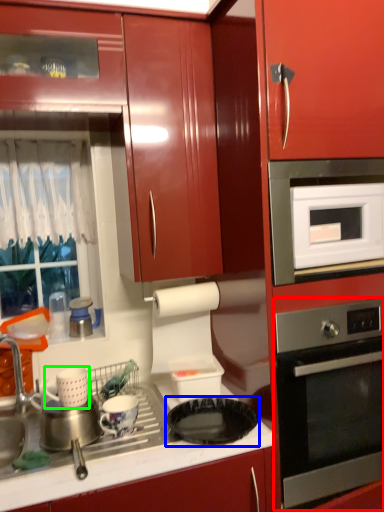
Question: Which is farther away from home appliance (highlighted by a red box)? gas stove (highlighted by a blue box) or appliance (highlighted by a green box)?

Choices:
 (A) gas stove
 (B) appliance

Answer: (B)